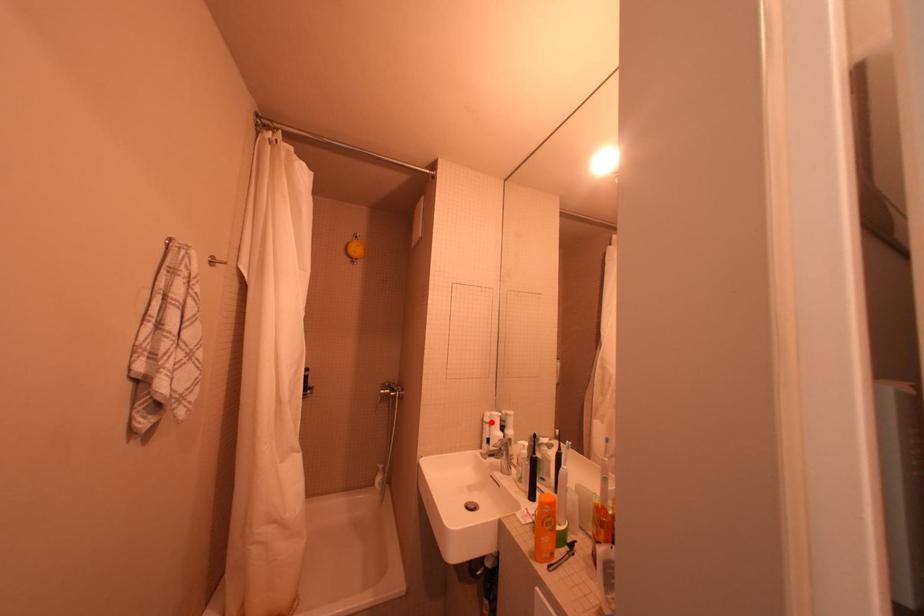
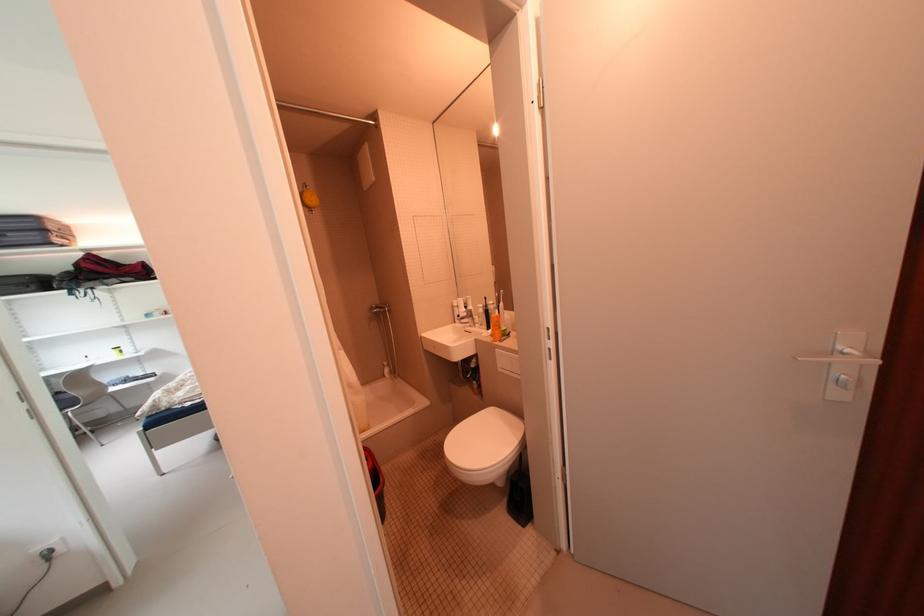
In the second image, find the point that corresponds to the highlighted location in the first image.

(460, 308)